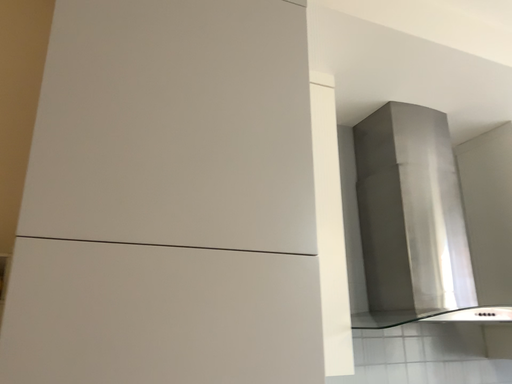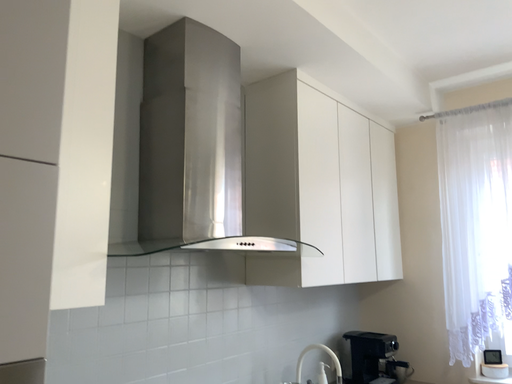
Question: How did the camera likely rotate when shooting the video?

Choices:
 (A) rotated right
 (B) rotated left

Answer: (A)